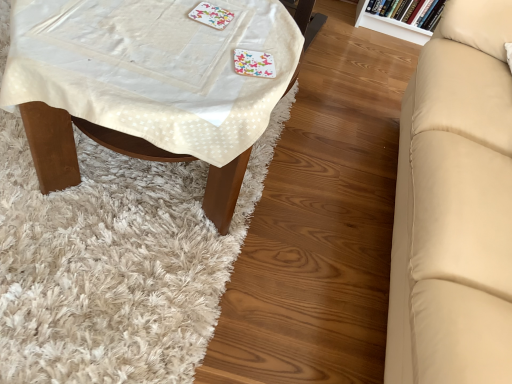
Question: Could you tell me if white fabric-covered table at left is facing white textured mat at lower left?

Choices:
 (A) no
 (B) yes

Answer: (A)

Question: Considering the relative sizes of white fabric-covered table at left and white textured mat at lower left in the image provided, is white fabric-covered table at left thinner than white textured mat at lower left?

Choices:
 (A) yes
 (B) no

Answer: (A)

Question: Is white fabric-covered table at left completely or partially outside of white textured mat at lower left?

Choices:
 (A) yes
 (B) no

Answer: (A)

Question: Is white textured mat at lower left located within white fabric-covered table at left?

Choices:
 (A) no
 (B) yes

Answer: (A)

Question: Can you confirm if white fabric-covered table at left is shorter than white textured mat at lower left?

Choices:
 (A) no
 (B) yes

Answer: (A)

Question: Is white fabric-covered table at left behind white textured mat at lower left?

Choices:
 (A) no
 (B) yes

Answer: (A)

Question: Considering the relative sizes of white glossy bookshelf at upper right and white textured mat at lower left in the image provided, is white glossy bookshelf at upper right taller than white textured mat at lower left?

Choices:
 (A) no
 (B) yes

Answer: (B)

Question: Is white glossy bookshelf at upper right at the left side of white textured mat at lower left?

Choices:
 (A) yes
 (B) no

Answer: (B)

Question: Is white glossy bookshelf at upper right beside white textured mat at lower left?

Choices:
 (A) yes
 (B) no

Answer: (B)

Question: Is white textured mat at lower left surrounded by white glossy bookshelf at upper right?

Choices:
 (A) yes
 (B) no

Answer: (B)

Question: Is white glossy bookshelf at upper right outside of white textured mat at lower left?

Choices:
 (A) yes
 (B) no

Answer: (A)

Question: Is the depth of white glossy bookshelf at upper right greater than that of white textured mat at lower left?

Choices:
 (A) no
 (B) yes

Answer: (B)

Question: From the image's perspective, is white fabric-covered table at left on colorful paper coaster at upper center?

Choices:
 (A) yes
 (B) no

Answer: (B)